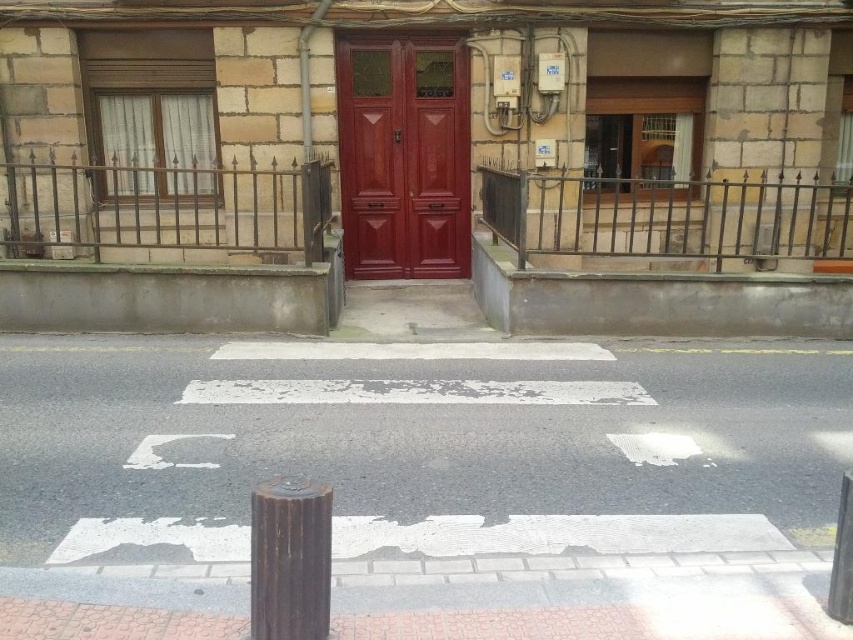
Does point (798, 413) come behind point (318, 620)?

Yes.

Does white asphalt at center have a smaller size compared to rusty metal pole at lower center?

Actually, white asphalt at center might be larger than rusty metal pole at lower center.

Is point (88, 518) more distant than point (291, 628)?

Yes, it is behind point (291, 628).

Where is `white asphalt at center`? The width and height of the screenshot is (853, 640). white asphalt at center is located at coordinates (418, 449).

Does gray concrete curb at lower center have a larger size compared to rusty metal pole at lower center?

Yes, gray concrete curb at lower center is bigger than rusty metal pole at lower center.

Between gray concrete curb at lower center and rusty metal pole at lower center, which one appears on the right side from the viewer's perspective?

Positioned to the right is gray concrete curb at lower center.

Between point (573, 272) and point (250, 545), which one is positioned behind?

The point (573, 272) is more distant.

Find the location of a particular element. The image size is (853, 640). gray concrete curb at lower center is located at coordinates (656, 301).

Does white asphalt at center have a greater height compared to matte wood door at center?

No, white asphalt at center is not taller than matte wood door at center.

Can you confirm if white asphalt at center is positioned to the left of matte wood door at center?

In fact, white asphalt at center is to the right of matte wood door at center.

Find the location of `white asphalt at center`. white asphalt at center is located at coordinates (418, 449).

Image resolution: width=853 pixels, height=640 pixels. Identify the location of white asphalt at center. (418, 449).